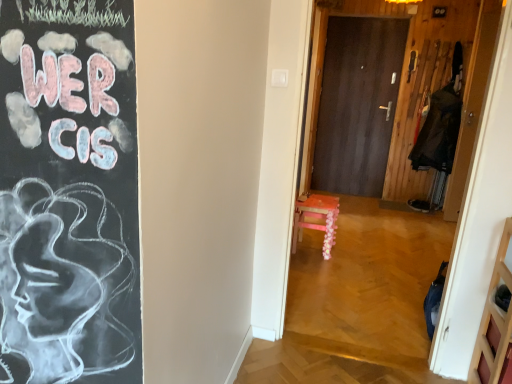
Question: Is point (458, 122) positioned closer to the camera than point (370, 21)?

Choices:
 (A) farther
 (B) closer

Answer: (B)

Question: Is dark blue fabric coat at right taller or shorter than dark wood door at center, positioned as the second door in right-to-left order?

Choices:
 (A) short
 (B) tall

Answer: (A)

Question: Estimate the real-world distances between objects in this image. Which object is closer to the dark blue fabric coat at right?

Choices:
 (A) dark wood door at center, positioned as the 1th door in back-to-front order
 (B) wooden door at right, which appears as the 2th door when viewed from the back
 (C) wooden floral-patterned stool at center

Answer: (B)

Question: Which of these objects is positioned closest to the wooden door at right, which appears as the 2th door when viewed from the back?

Choices:
 (A) wooden floral-patterned stool at center
 (B) dark wood door at center, positioned as the 1th door in back-to-front order
 (C) dark blue fabric coat at right

Answer: (C)